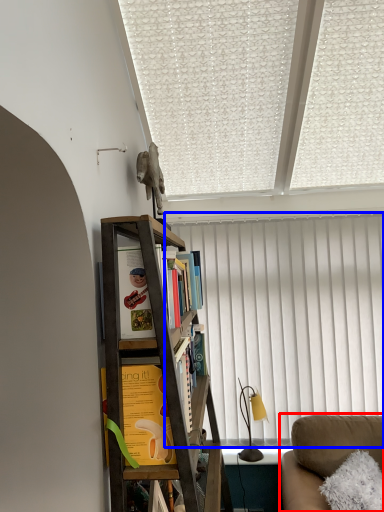
Question: Which object appears closest to the camera in this image, studio couch (highlighted by a red box) or curtain (highlighted by a blue box)?

Choices:
 (A) studio couch
 (B) curtain

Answer: (A)